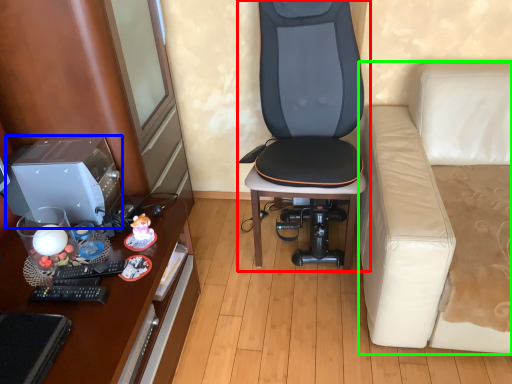
Question: Based on their relative distances, which object is farther from chair (highlighted by a red box)? Choose from desktop computer (highlighted by a blue box) and studio couch (highlighted by a green box).

Choices:
 (A) desktop computer
 (B) studio couch

Answer: (A)